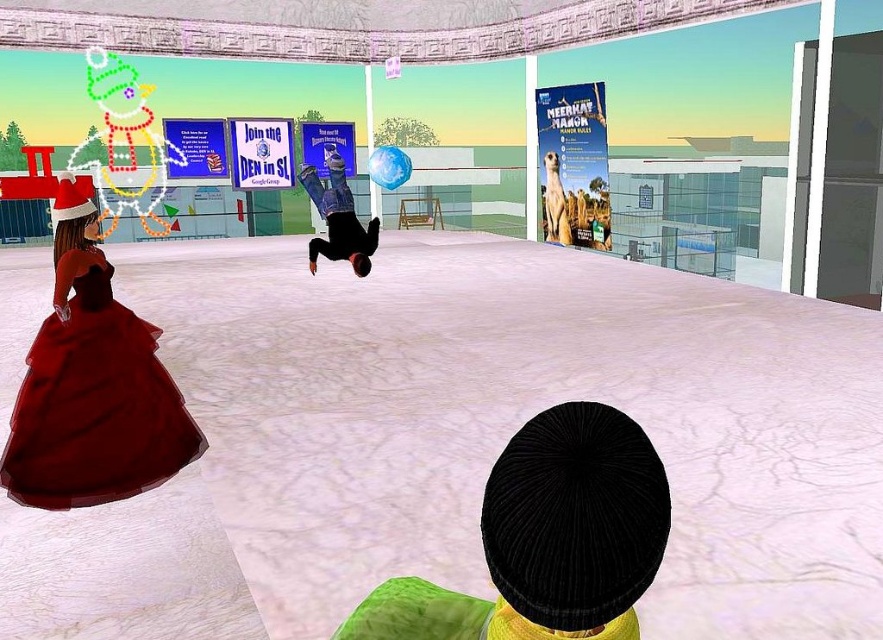
You are a virtual assistant in this digital space. You need to move a small object from the velvet red dress at lower left to the black matte person at center. The object is 1 foot in length. What is the minimum distance you need to move it?

The velvet red dress at lower left is 12.11 feet away from the black matte person at center. Therefore, the minimum distance you need to move the object is 12.11 feet.

You are navigating a virtual room where the black corduroy hat at center is located at coordinates point (547,540). If you want to move towards this hat, which direction should you head?

The point (547,540) marks the location of the black corduroy hat at center, so moving towards that coordinate will lead you directly to the hat.